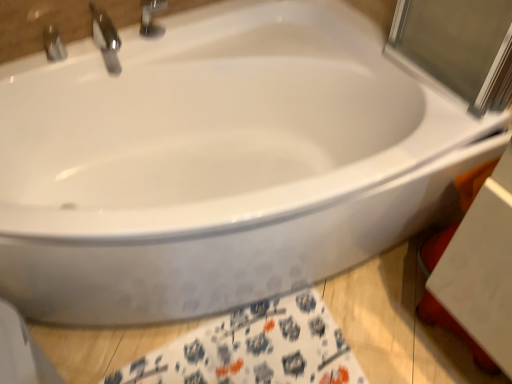
Question: From a real-world perspective, does metallic silver faucet at upper left, which is the second tap from right to left, stand above polished chrome faucet at upper left, the 1th tap positioned from the right?

Choices:
 (A) yes
 (B) no

Answer: (B)

Question: Can you confirm if metallic silver faucet at upper left, which is the second tap from right to left, is thinner than polished chrome faucet at upper left, placed as the second tap when sorted from left to right?

Choices:
 (A) yes
 (B) no

Answer: (A)

Question: Considering the relative positions of metallic silver faucet at upper left, the first tap positioned from the left, and polished chrome faucet at upper left, the 1th tap positioned from the right, in the image provided, is metallic silver faucet at upper left, the first tap positioned from the left, to the left of polished chrome faucet at upper left, the 1th tap positioned from the right, from the viewer's perspective?

Choices:
 (A) no
 (B) yes

Answer: (B)

Question: Considering the relative positions of metallic silver faucet at upper left, the first tap positioned from the left, and polished chrome faucet at upper left, the 1th tap positioned from the right, in the image provided, is metallic silver faucet at upper left, the first tap positioned from the left, behind polished chrome faucet at upper left, the 1th tap positioned from the right,?

Choices:
 (A) yes
 (B) no

Answer: (A)

Question: From a real-world perspective, is metallic silver faucet at upper left, the first tap positioned from the left, physically below polished chrome faucet at upper left, the 1th tap positioned from the right?

Choices:
 (A) yes
 (B) no

Answer: (A)

Question: Considering the relative sizes of metallic silver faucet at upper left, which is the second tap from right to left, and polished chrome faucet at upper left, placed as the second tap when sorted from left to right, in the image provided, is metallic silver faucet at upper left, which is the second tap from right to left, shorter than polished chrome faucet at upper left, placed as the second tap when sorted from left to right,?

Choices:
 (A) yes
 (B) no

Answer: (A)

Question: Is metallic silver faucet at upper left, the first tap positioned from the left, touching white fabric towel at lower center?

Choices:
 (A) yes
 (B) no

Answer: (B)

Question: Is metallic silver faucet at upper left, the first tap positioned from the left, not within white fabric towel at lower center?

Choices:
 (A) no
 (B) yes

Answer: (B)

Question: Is metallic silver faucet at upper left, the first tap positioned from the left, oriented away from white fabric towel at lower center?

Choices:
 (A) yes
 (B) no

Answer: (B)

Question: Is the depth of metallic silver faucet at upper left, which is the second tap from right to left, less than that of white fabric towel at lower center?

Choices:
 (A) no
 (B) yes

Answer: (A)

Question: Is white fabric towel at lower center a part of metallic silver faucet at upper left, the first tap positioned from the left?

Choices:
 (A) yes
 (B) no

Answer: (B)

Question: Can you confirm if metallic silver faucet at upper left, the first tap positioned from the left, is bigger than white fabric towel at lower center?

Choices:
 (A) no
 (B) yes

Answer: (A)

Question: Is polished chrome faucet at upper left, placed as the second tap when sorted from left to right, positioned far away from white fabric towel at lower center?

Choices:
 (A) yes
 (B) no

Answer: (A)